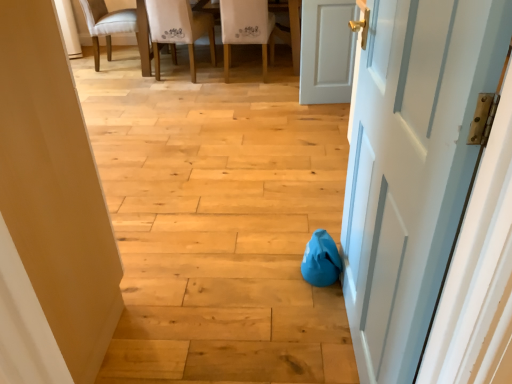
Question: Is white fabric chair at upper center, which is counted as the first chair, starting from the right, to the left of light beige fabric chair at upper left, placed as the third chair when sorted from right to left, from the viewer's perspective?

Choices:
 (A) no
 (B) yes

Answer: (A)

Question: Considering the relative sizes of white fabric chair at upper center, which ranks as the 3th chair in left-to-right order, and light beige fabric chair at upper left, placed as the third chair when sorted from right to left, in the image provided, is white fabric chair at upper center, which ranks as the 3th chair in left-to-right order, thinner than light beige fabric chair at upper left, placed as the third chair when sorted from right to left,?

Choices:
 (A) no
 (B) yes

Answer: (A)

Question: Are white fabric chair at upper center, which is counted as the first chair, starting from the right, and light beige fabric chair at upper left, which is the first chair in left-to-right order, beside each other?

Choices:
 (A) yes
 (B) no

Answer: (B)

Question: Considering the relative sizes of white fabric chair at upper center, which ranks as the 3th chair in left-to-right order, and light beige fabric chair at upper left, placed as the third chair when sorted from right to left, in the image provided, is white fabric chair at upper center, which ranks as the 3th chair in left-to-right order, wider than light beige fabric chair at upper left, placed as the third chair when sorted from right to left,?

Choices:
 (A) yes
 (B) no

Answer: (A)

Question: Is white fabric chair at upper center, which is counted as the first chair, starting from the right, taller than light beige fabric chair at upper left, which is the first chair in left-to-right order?

Choices:
 (A) no
 (B) yes

Answer: (B)

Question: Is light beige fabric chair at upper left, placed as the third chair when sorted from right to left, completely or partially inside white fabric chair at upper center, which ranks as the 3th chair in left-to-right order?

Choices:
 (A) no
 (B) yes

Answer: (A)

Question: Is white fabric chair at upper center, marked as the second chair in a right-to-left arrangement, surrounded by white painted wood door at right, which is the first door in front-to-back order?

Choices:
 (A) no
 (B) yes

Answer: (A)

Question: Does white painted wood door at right, which is counted as the second door, starting from the left, have a greater height compared to white fabric chair at upper center, marked as the second chair in a right-to-left arrangement?

Choices:
 (A) no
 (B) yes

Answer: (B)

Question: Is white painted wood door at right, arranged as the third door when viewed from the back, to the left of white fabric chair at upper center, marked as the second chair in a right-to-left arrangement, from the viewer's perspective?

Choices:
 (A) yes
 (B) no

Answer: (B)

Question: Is white painted wood door at right, which is counted as the second door, starting from the left, turned away from white fabric chair at upper center, marked as the second chair in a left-to-right arrangement?

Choices:
 (A) yes
 (B) no

Answer: (B)

Question: Is white painted wood door at right, the second door from the right, thinner than white fabric chair at upper center, marked as the second chair in a right-to-left arrangement?

Choices:
 (A) no
 (B) yes

Answer: (B)

Question: From a real-world perspective, is white painted wood door at right, which is counted as the second door, starting from the left, beneath white fabric chair at upper center, marked as the second chair in a right-to-left arrangement?

Choices:
 (A) yes
 (B) no

Answer: (B)

Question: Can you confirm if white matte door at right, the 3th door from the front, is shorter than light beige fabric chair at upper left, placed as the third chair when sorted from right to left?

Choices:
 (A) no
 (B) yes

Answer: (A)